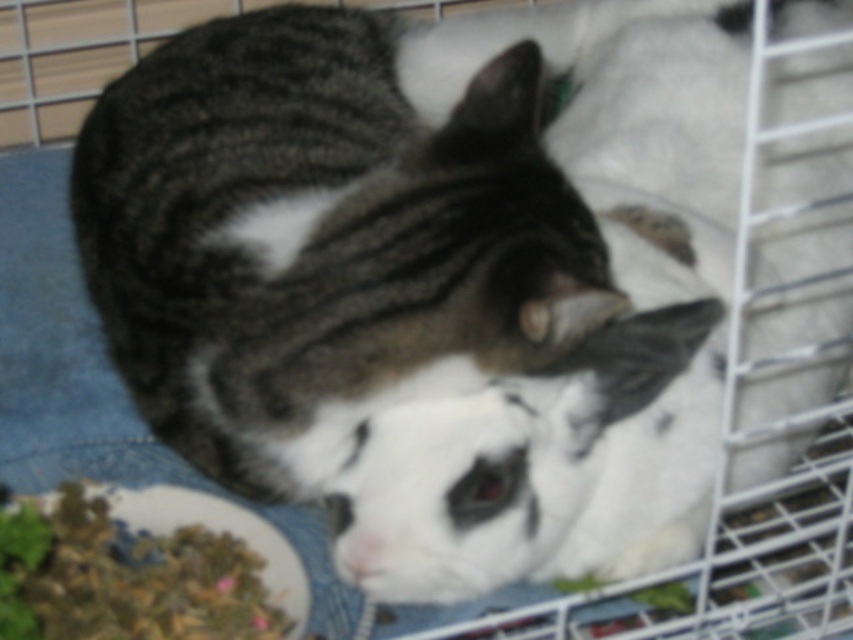
Question: Can you confirm if gray tabby cat at center is bigger than green leafy material at lower left?

Choices:
 (A) yes
 (B) no

Answer: (A)

Question: Is gray tabby cat at center below green leafy material at lower left?

Choices:
 (A) yes
 (B) no

Answer: (B)

Question: Which object appears closest to the camera in this image?

Choices:
 (A) gray tabby cat at center
 (B) green leafy material at lower left

Answer: (A)

Question: Is gray tabby cat at center thinner than green leafy material at lower left?

Choices:
 (A) yes
 (B) no

Answer: (B)

Question: Among these points, which one is farthest from the camera?

Choices:
 (A) (363, 266)
 (B) (195, 616)

Answer: (B)